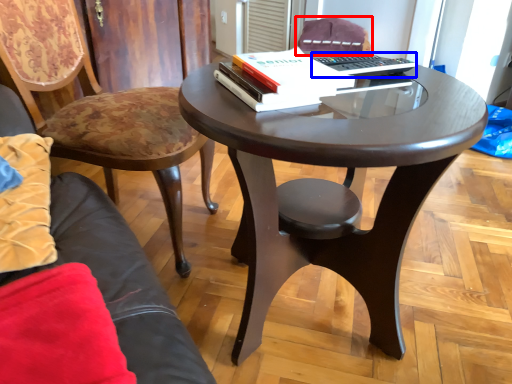
Question: Which point is further to the camera, chair (highlighted by a red box) or laptop keyboard (highlighted by a blue box)?

Choices:
 (A) chair
 (B) laptop keyboard

Answer: (A)